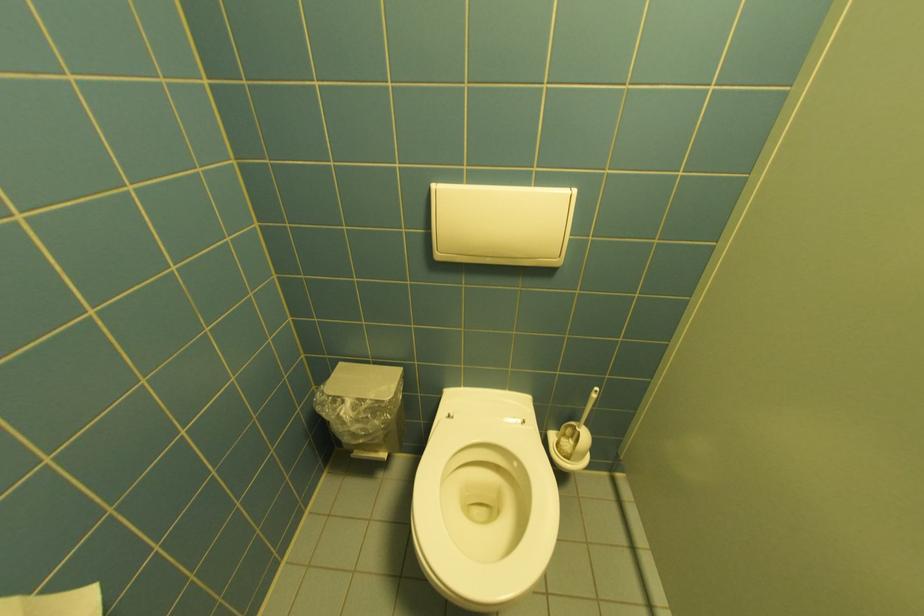
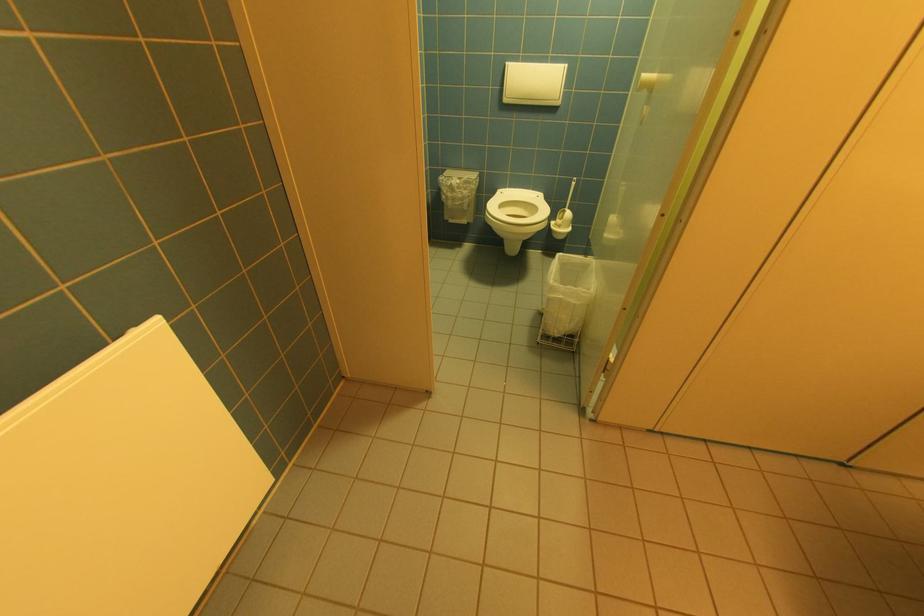
Find the pixel in the second image that matches [575,432] in the first image.

(567, 215)